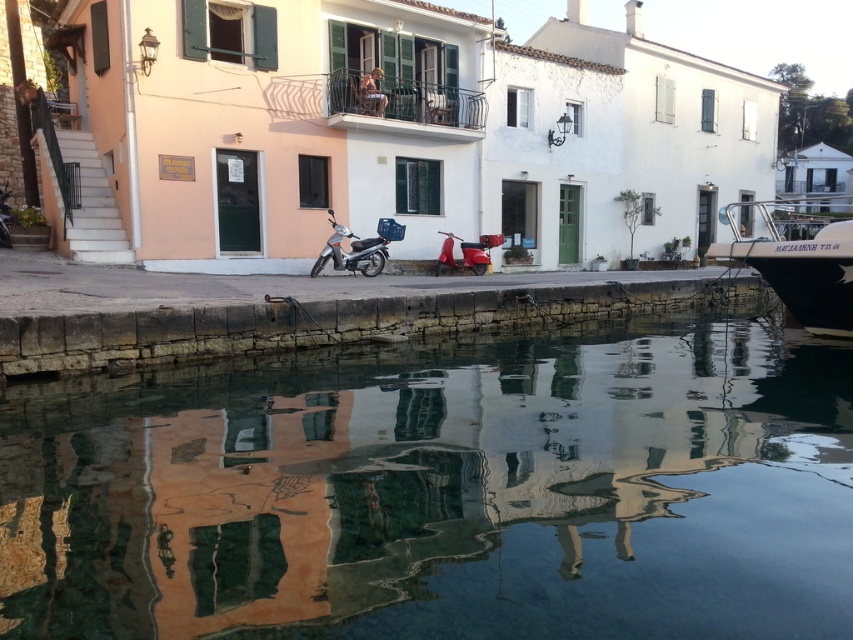
You are planning to transport a large sculpture that is 3 meters wide. You have access to both the metallic silver boat at right and the metallic silver scooter at center. Based on their widths, which one can accommodate the sculpture?

The metallic silver boat at right has a greater width than the metallic silver scooter at center, so the sculpture can be accommodated on the metallic silver boat at right.

You are standing on the waterfront and see both the metallic silver boat at right and the metallic silver scooter at center. Which one is closer to the water?

The metallic silver boat at right is positioned over the metallic silver scooter at center, meaning it is closer to the water than the scooter.